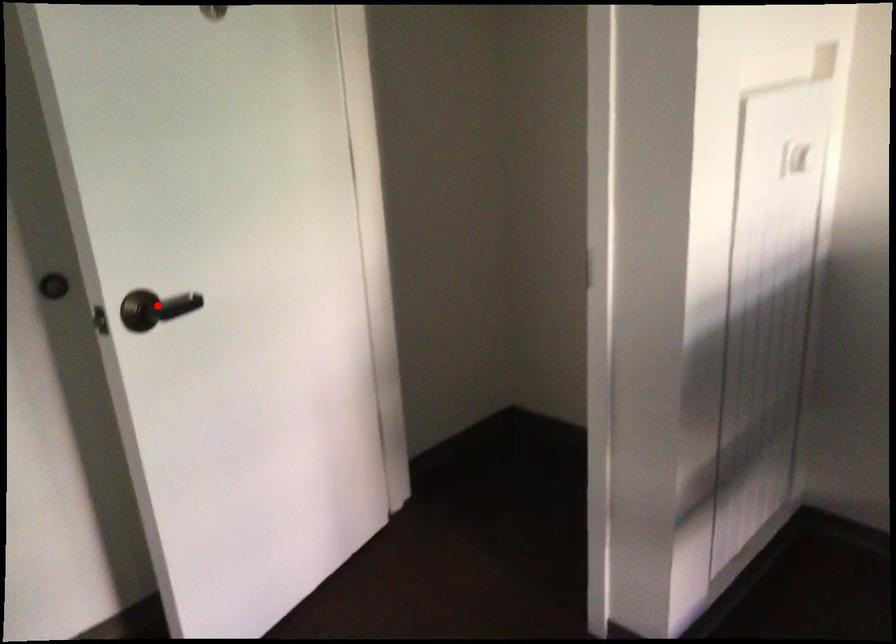
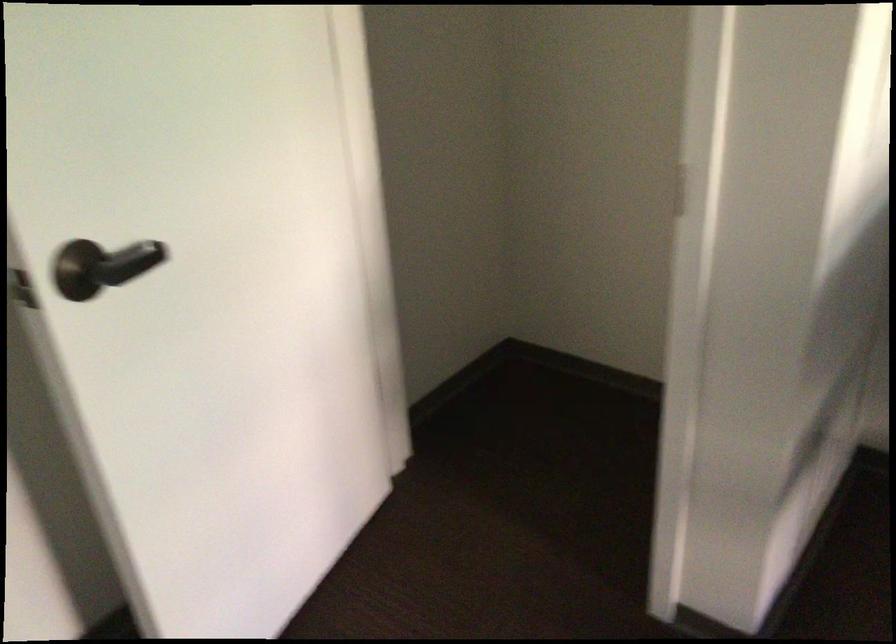
Question: A red point is marked in image1. In image2, is the corresponding 3D point closer to the camera or farther? Reply with the corresponding letter.

Choices:
 (A) The corresponding 3D point is closer.
 (B) The corresponding 3D point is farther.

Answer: (A)